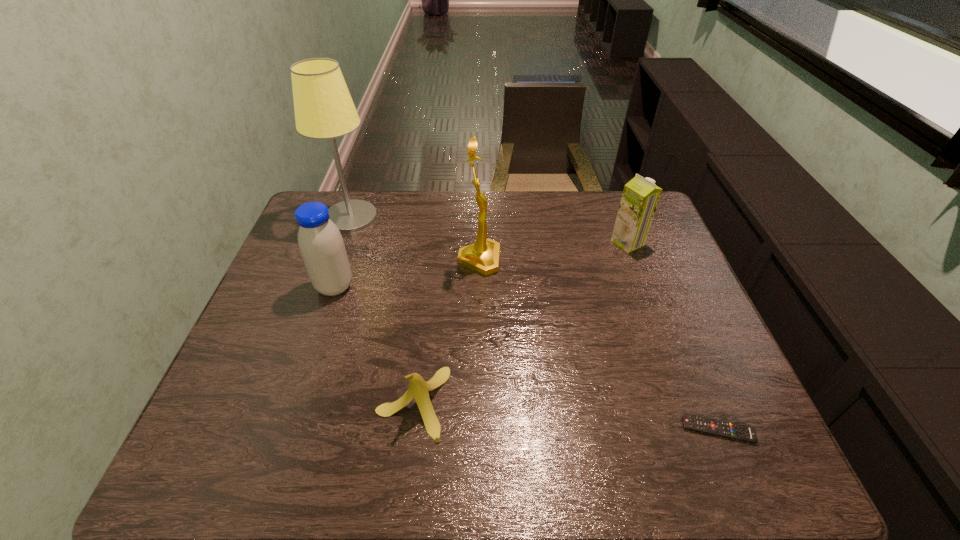
Identify the location of remote control present at the right edge. point(726,429).

Image resolution: width=960 pixels, height=540 pixels. Find the location of `object situated at the far left corner`. object situated at the far left corner is located at coordinates (324, 109).

I want to click on object that is at the near right corner, so click(x=726, y=429).

In the image, there is a desktop. Identify the location of vacant space at the far edge. This screenshot has height=540, width=960. (447, 202).

You are a GUI agent. You are given a task and a screenshot of the screen. Output one action in this format:
    pyautogui.click(x=<x>, y=<y>)
    Task: Click on the vacant area at the near edge
    The height and width of the screenshot is (540, 960).
    Given the screenshot: What is the action you would take?
    pyautogui.click(x=376, y=475)

Where is `vacant space at the left edge of the desktop`? Image resolution: width=960 pixels, height=540 pixels. vacant space at the left edge of the desktop is located at coordinates (268, 285).

At what (x,y) coordinates should I click in order to perform the action: click on free space at the right edge of the desktop. Please return your answer as a coordinate pair (x, y). Looking at the image, I should click on (669, 240).

This screenshot has height=540, width=960. What are the coordinates of `free space at the far left corner` in the screenshot? It's located at (318, 199).

In the image, there is a desktop. Where is `vacant space at the near left corner`? This screenshot has width=960, height=540. vacant space at the near left corner is located at coordinates (247, 468).

Find the location of a particular element. The height and width of the screenshot is (540, 960). free space between the table lamp and the farther soya milk is located at coordinates (490, 230).